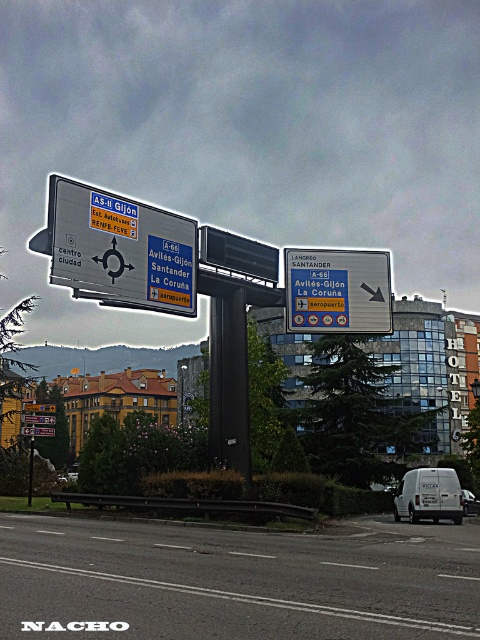
Question: Which point is closer to the camera?

Choices:
 (A) metallic silver sign at center
 (B) metallic pole at center

Answer: (A)

Question: Is white matte van at lower right behind white matte van at center?

Choices:
 (A) no
 (B) yes

Answer: (A)

Question: Is blue plastic sign at center in front of white matte van at lower right?

Choices:
 (A) yes
 (B) no

Answer: (B)

Question: Can you confirm if white matte van at center is positioned to the right of metallic pole at center?

Choices:
 (A) no
 (B) yes

Answer: (B)

Question: Which is nearer to the metallic pole at center?

Choices:
 (A) blue plastic sign at center
 (B) white matte van at lower right
 (C) white matte van at center
 (D) metallic silver sign at center

Answer: (D)

Question: Which object is positioned farthest from the white matte van at lower right?

Choices:
 (A) blue plastic sign at center
 (B) metallic silver sign at center

Answer: (B)